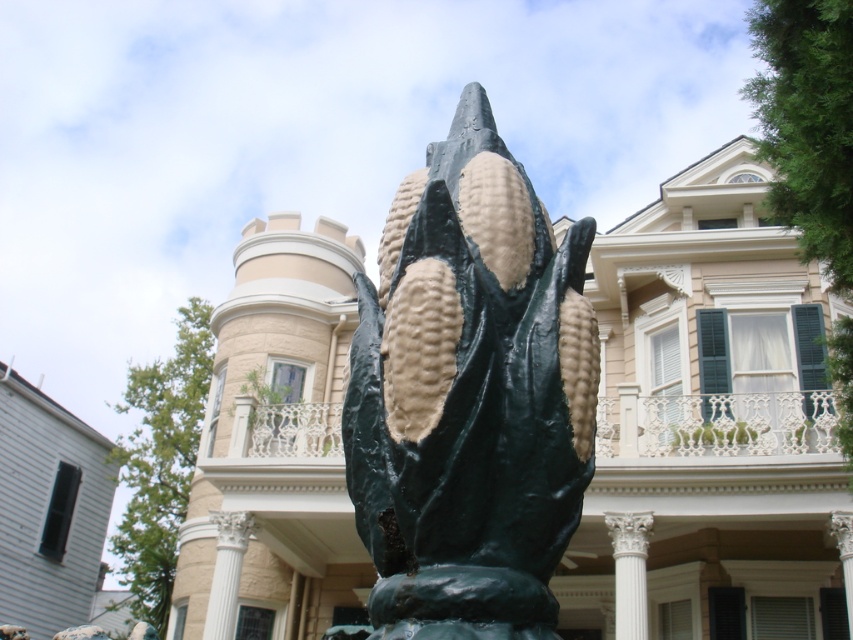
You are standing in front of the sculpture and notice the green matte corn at center and the white marble column at center. Which object is positioned to the left?

The green matte corn at center is to the left of the white marble column at center.

You are standing in front of the sculpture and want to take a photo that shows both the green matte corn at center and the white glossy column at center. Based on their positions, which object should you position to the left side of your camera frame?

The white glossy column at center should be positioned to the left side of your camera frame because the green matte corn at center is located to the right of the white glossy column at center.

You are an architect designing a new plaza and need to ensure that the green matte corn at center and the white marble column at center can be viewed clearly from a distance. Based on their sizes, which object might require more space between them to maintain visibility?

The green matte corn at center has a larger width than the white marble column at center, so it might require more space between them to ensure clear visibility from a distance.